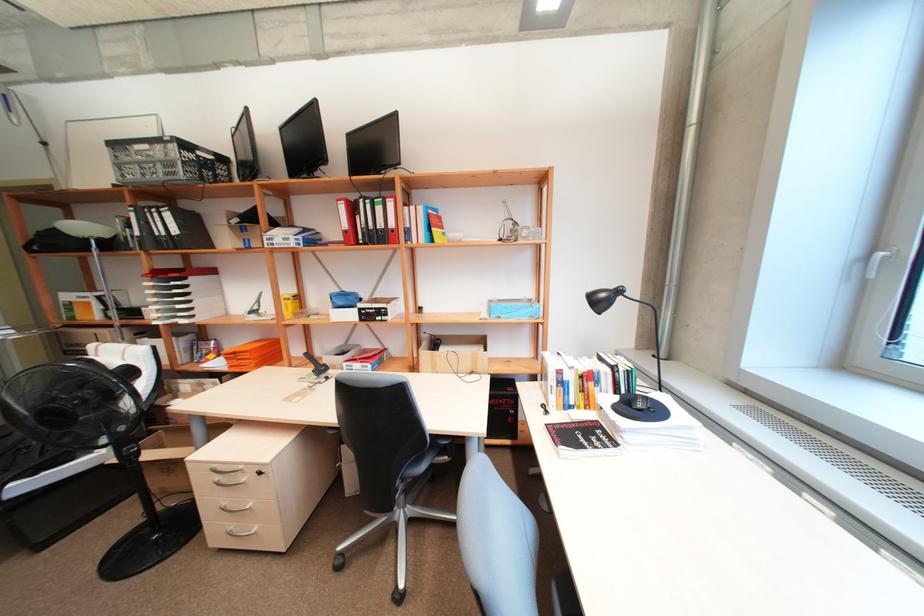
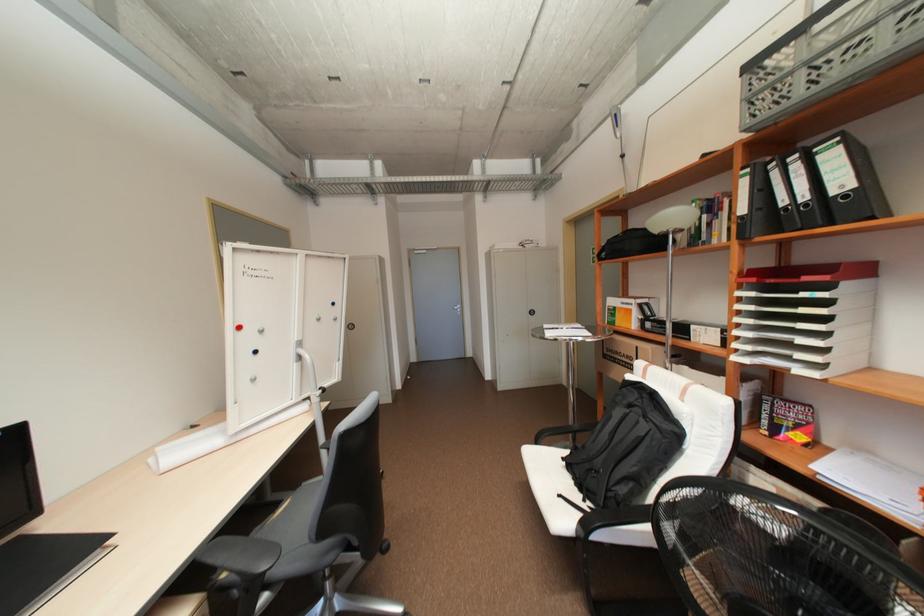
Find the pixel in the second image that matches point 169,233 in the first image.

(810, 197)